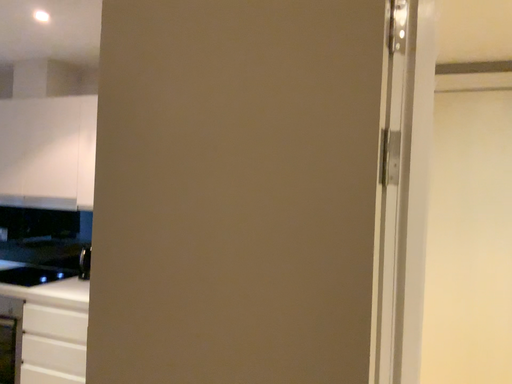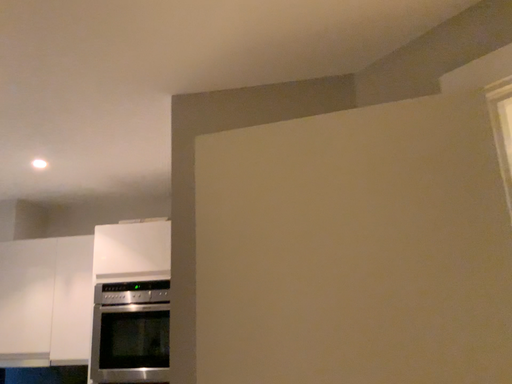
Question: How did the camera likely rotate when shooting the video?

Choices:
 (A) rotated upward
 (B) rotated downward

Answer: (A)